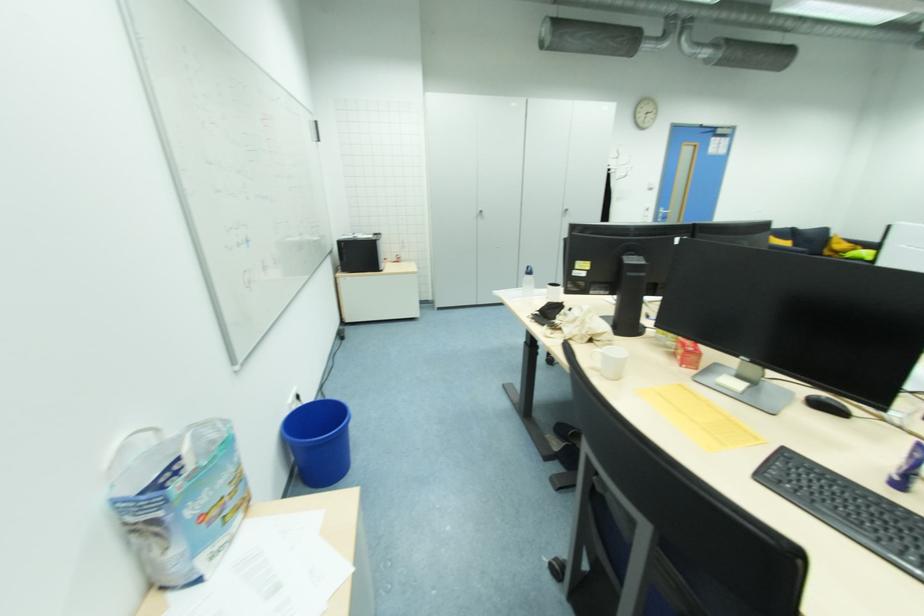
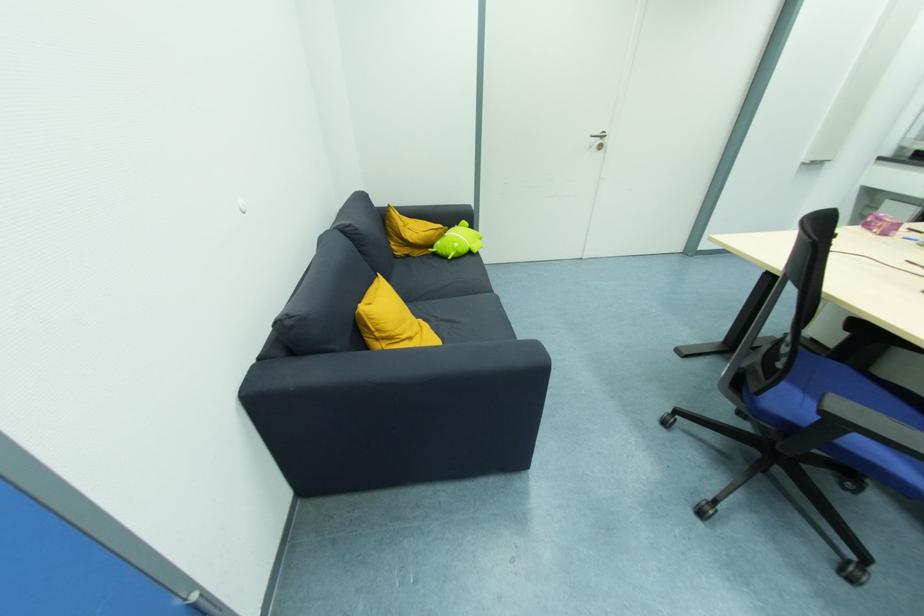
Question: I am providing you with two images of the same scene from different viewpoints. After the viewpoint changes to image2, which objects are now occluded?

Choices:
 (A) white light switch
 (B) white door handle
 (C) sofa armrest
 (D) none of these

Answer: (D)